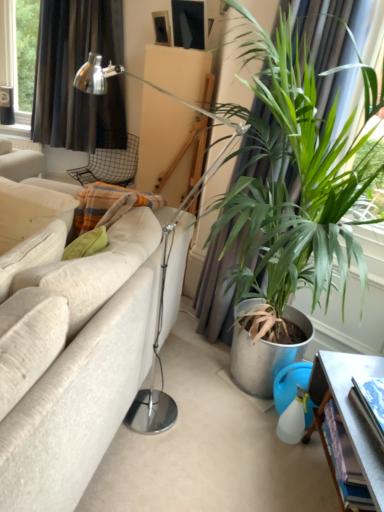
Question: Could you tell me if metallic gray table at lower right is turned towards green leafy plant at right?

Choices:
 (A) no
 (B) yes

Answer: (A)

Question: Is green leafy plant at right inside metallic gray table at lower right?

Choices:
 (A) yes
 (B) no

Answer: (B)

Question: Is metallic gray table at lower right looking in the opposite direction of green leafy plant at right?

Choices:
 (A) yes
 (B) no

Answer: (B)

Question: From the image's perspective, does metallic gray table at lower right appear higher than green leafy plant at right?

Choices:
 (A) yes
 (B) no

Answer: (B)

Question: Is the position of metallic gray table at lower right less distant than that of green leafy plant at right?

Choices:
 (A) yes
 (B) no

Answer: (A)

Question: Is metallic gray table at lower right wider than green leafy plant at right?

Choices:
 (A) no
 (B) yes

Answer: (B)

Question: From a real-world perspective, is matte black picture frame at upper center physically above metal mesh chair at upper center?

Choices:
 (A) yes
 (B) no

Answer: (A)

Question: Can you confirm if matte black picture frame at upper center is taller than metal mesh chair at upper center?

Choices:
 (A) no
 (B) yes

Answer: (A)

Question: Is metal mesh chair at upper center surrounded by matte black picture frame at upper center?

Choices:
 (A) no
 (B) yes

Answer: (A)

Question: Is matte black picture frame at upper center far away from metal mesh chair at upper center?

Choices:
 (A) yes
 (B) no

Answer: (A)

Question: From a real-world perspective, is matte black picture frame at upper center below metal mesh chair at upper center?

Choices:
 (A) yes
 (B) no

Answer: (B)

Question: Is matte black picture frame at upper center touching metal mesh chair at upper center?

Choices:
 (A) yes
 (B) no

Answer: (B)

Question: Can you confirm if black fabric curtain at upper left is shorter than matte black picture frame at upper center?

Choices:
 (A) yes
 (B) no

Answer: (B)